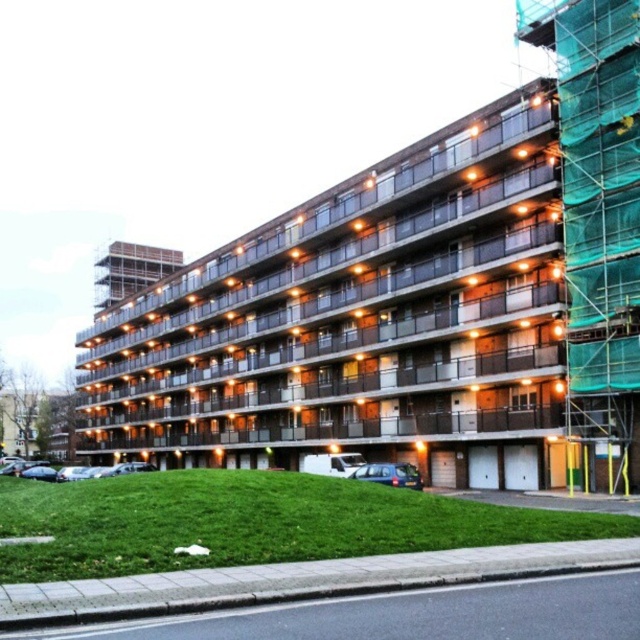
Question: Is brown concrete building at center to the left of green mesh scaffolding at right from the viewer's perspective?

Choices:
 (A) yes
 (B) no

Answer: (A)

Question: Is the position of brown concrete building at center more distant than that of green mesh scaffolding at right?

Choices:
 (A) yes
 (B) no

Answer: (A)

Question: Is brown concrete building at center smaller than green mesh scaffolding at right?

Choices:
 (A) yes
 (B) no

Answer: (B)

Question: Which point is closer to the camera?

Choices:
 (A) green mesh scaffolding at right
 (B) brown concrete building at center

Answer: (A)